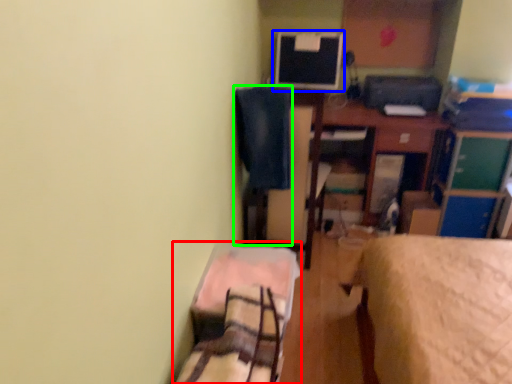
Question: Based on their relative distances, which object is nearer to bed (highlighted by a red box)? Choose from computer monitor (highlighted by a blue box) and swivel chair (highlighted by a green box).

Choices:
 (A) computer monitor
 (B) swivel chair

Answer: (B)